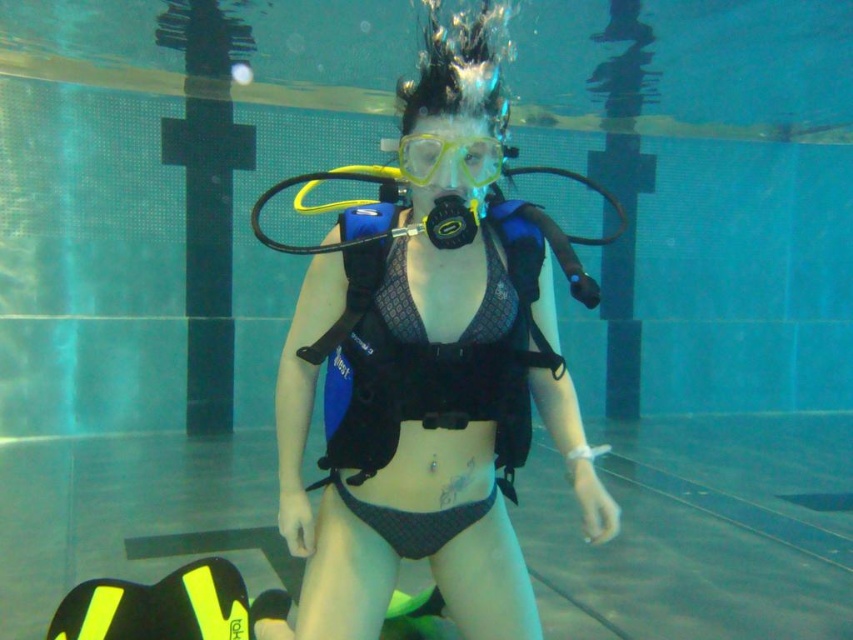
Question: Which object appears closest to the camera in this image?

Choices:
 (A) yellow matte/glossy goggles at center
 (B) black mesh bikini at center
 (C) matte blue scuba vest at center

Answer: (C)

Question: Can you confirm if black mesh bikini at center is thinner than yellow matte/glossy goggles at center?

Choices:
 (A) no
 (B) yes

Answer: (A)

Question: Which object appears closest to the camera in this image?

Choices:
 (A) yellow matte/glossy goggles at center
 (B) black mesh bikini at center
 (C) matte blue scuba vest at center

Answer: (C)

Question: Is black mesh bikini at center positioned at the back of yellow matte/glossy goggles at center?

Choices:
 (A) no
 (B) yes

Answer: (B)

Question: Is matte blue scuba vest at center to the left of black mesh bikini at center from the viewer's perspective?

Choices:
 (A) yes
 (B) no

Answer: (B)

Question: Which point is farther to the camera?

Choices:
 (A) matte blue scuba vest at center
 (B) yellow matte/glossy goggles at center
 (C) black mesh bikini at center

Answer: (C)